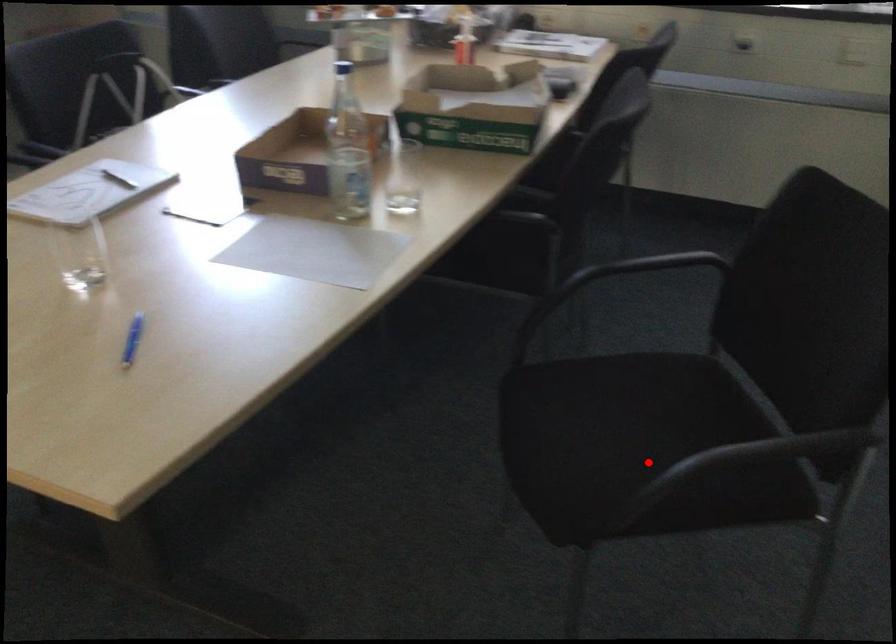
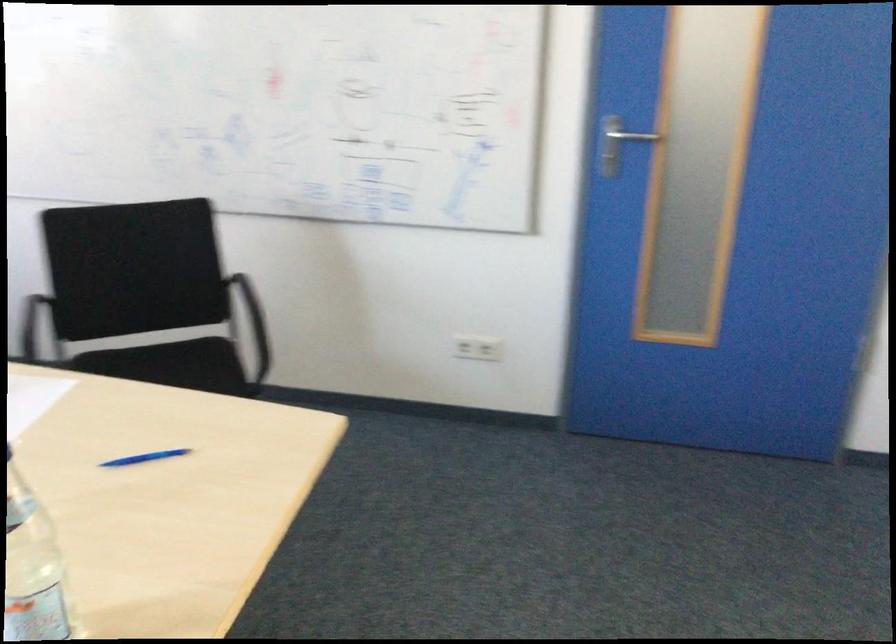
In the second image, find the point that corresponds to the highlighted location in the first image.

(194, 364)